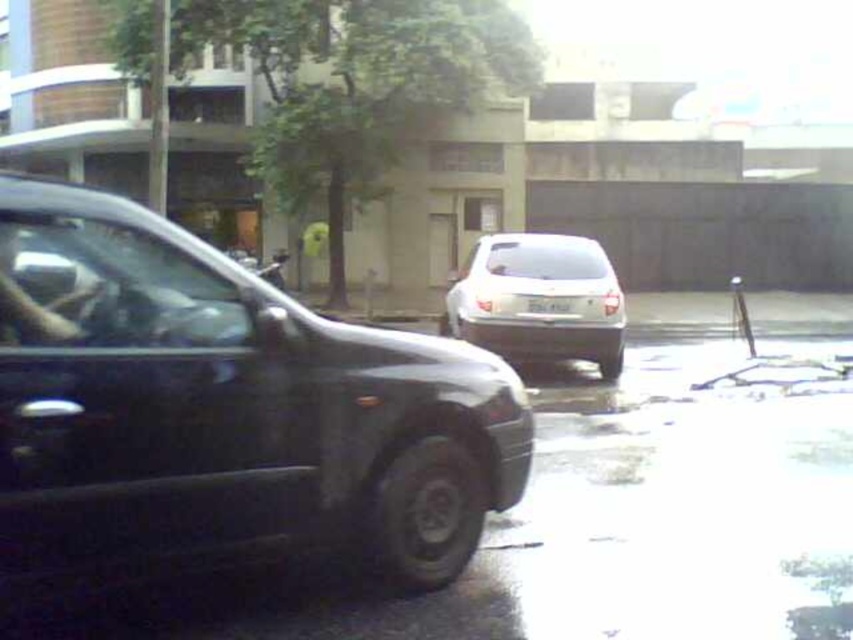
Question: Is shiny black sedan at left behind satin white suv at center?

Choices:
 (A) no
 (B) yes

Answer: (A)

Question: Among these points, which one is farthest from the camera?

Choices:
 (A) (579, 348)
 (B) (534, 300)
 (C) (154, 460)

Answer: (A)

Question: Is shiny black sedan at left above satin white suv at center?

Choices:
 (A) no
 (B) yes

Answer: (A)

Question: Which of the following is the closest to the observer?

Choices:
 (A) satin white suv at center
 (B) shiny black sedan at left
 (C) white plastic license plate at center

Answer: (B)

Question: Is the position of shiny black sedan at left more distant than that of white plastic license plate at center?

Choices:
 (A) no
 (B) yes

Answer: (A)

Question: Which point appears farthest from the camera in this image?

Choices:
 (A) (399, 488)
 (B) (540, 310)
 (C) (556, 294)

Answer: (B)